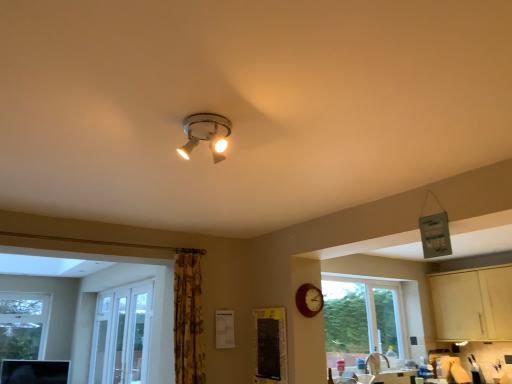
Question: Is black fabric bulletin board at lower center bigger or smaller than matte silver spotlight at upper center?

Choices:
 (A) big
 (B) small

Answer: (A)

Question: From their relative heights in the image, would you say black fabric bulletin board at lower center is taller or shorter than matte silver spotlight at upper center?

Choices:
 (A) tall
 (B) short

Answer: (A)

Question: Which of these objects is positioned closest to the matte silver spotlight at upper center?

Choices:
 (A) black fabric bulletin board at lower center
 (B) light wood cabinet at lower right
 (C) yellow floral fabric curtain at center-left
 (D) wooden clock at lower right

Answer: (C)

Question: Based on their relative distances, which object is nearer to the light wood cabinet at lower right?

Choices:
 (A) black fabric bulletin board at lower center
 (B) wooden clock at lower right
 (C) yellow floral fabric curtain at center-left
 (D) matte silver spotlight at upper center

Answer: (B)